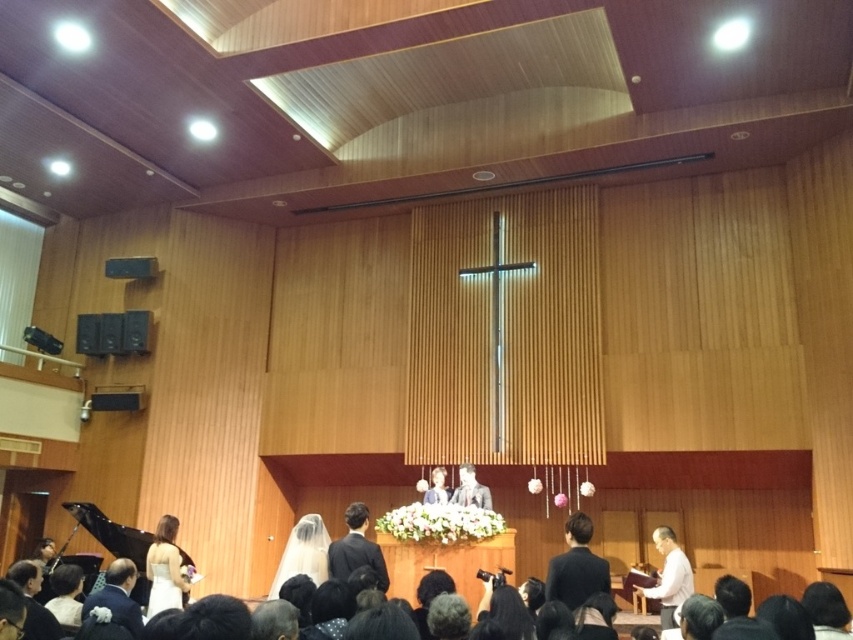
Is dark blue suit at center bigger than white paper at center?

Incorrect, dark blue suit at center is not larger than white paper at center.

Based on the photo, which is above, dark blue suit at center or white paper at center?

dark blue suit at center is above.

Does point (560, 563) come farther from viewer compared to point (664, 600)?

No, (560, 563) is in front of (664, 600).

Find the location of a particular element. This screenshot has height=640, width=853. dark blue suit at center is located at coordinates (576, 566).

Does white satin dress at lower left appear over light beige fabric dress at center?

Actually, white satin dress at lower left is below light beige fabric dress at center.

Who is lower down, white satin dress at lower left or light beige fabric dress at center?

white satin dress at lower left is below.

Does point (160, 518) lie behind point (438, 481)?

Yes, point (160, 518) is behind point (438, 481).

Identify the location of white satin dress at lower left. (164, 568).

Who is lower down, dark suit at center or smooth white dress at center?

smooth white dress at center is lower down.

Describe the element at coordinates (357, 548) in the screenshot. The image size is (853, 640). I see `dark suit at center` at that location.

Does point (331, 541) come closer to viewer compared to point (466, 502)?

No, it is not.

Find the location of a particular element. dark suit at center is located at coordinates click(357, 548).